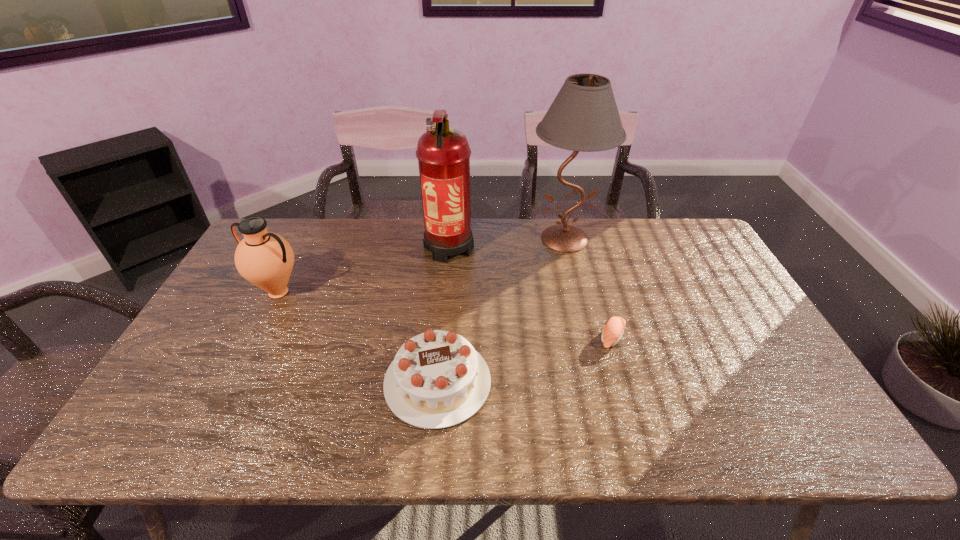
Locate an element on the screen. Image resolution: width=960 pixels, height=540 pixels. unoccupied area between the second shortest object and the third tallest object is located at coordinates (358, 337).

The height and width of the screenshot is (540, 960). Find the location of `object that stands as the second closest to the fire extinguisher`. object that stands as the second closest to the fire extinguisher is located at coordinates (437, 379).

Locate which object is the closest to the birthday cake. Please provide its 2D coordinates. Your answer should be formatted as a tuple, i.e. [(x, y)], where the tuple contains the x and y coordinates of a point satisfying the conditions above.

[(443, 153)]

At what (x,y) coordinates should I click in order to perform the action: click on free location that satisfies the following two spatial constraints: 1. on the front side of the sushi; 2. on the left side of the leftmost object. Please return your answer as a coordinate pair (x, y). The image size is (960, 540). Looking at the image, I should click on (255, 338).

Where is `vacant point that satisfies the following two spatial constraints: 1. on the front-facing side of the fire extinguisher; 2. on the left side of the second shortest object`? This screenshot has width=960, height=540. vacant point that satisfies the following two spatial constraints: 1. on the front-facing side of the fire extinguisher; 2. on the left side of the second shortest object is located at coordinates (437, 382).

Identify the location of free space that satisfies the following two spatial constraints: 1. on the front-facing side of the shortest object; 2. on the left side of the table lamp. (588, 338).

Locate an element on the screen. This screenshot has height=540, width=960. free space that satisfies the following two spatial constraints: 1. on the front-facing side of the sushi; 2. on the left side of the table lamp is located at coordinates (588, 338).

Where is `vacant space that satisfies the following two spatial constraints: 1. on the front-facing side of the table lamp; 2. on the right side of the sushi`? The image size is (960, 540). vacant space that satisfies the following two spatial constraints: 1. on the front-facing side of the table lamp; 2. on the right side of the sushi is located at coordinates (588, 338).

Where is `free space that satisfies the following two spatial constraints: 1. on the front-facing side of the table lamp; 2. on the right side of the sushi`? free space that satisfies the following two spatial constraints: 1. on the front-facing side of the table lamp; 2. on the right side of the sushi is located at coordinates (588, 338).